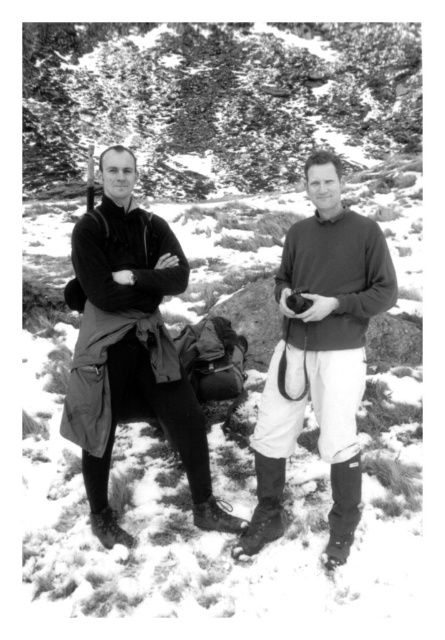
Question: Does matte black jacket at center appear over matte brown sweater at center?

Choices:
 (A) no
 (B) yes

Answer: (B)

Question: Which point is farther to the camera?

Choices:
 (A) matte brown sweater at center
 (B) matte black jacket at center

Answer: (B)

Question: Does matte black jacket at center come in front of matte brown sweater at center?

Choices:
 (A) yes
 (B) no

Answer: (B)

Question: Considering the relative positions of matte black jacket at center and matte brown sweater at center in the image provided, where is matte black jacket at center located with respect to matte brown sweater at center?

Choices:
 (A) left
 (B) right

Answer: (A)